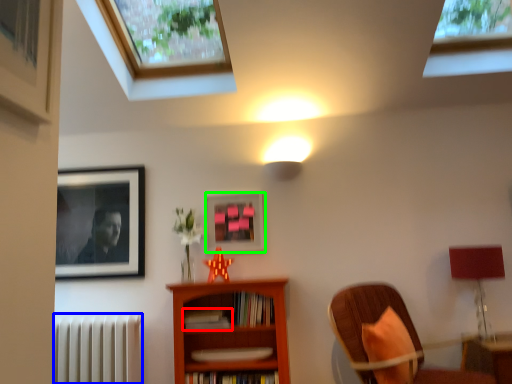
Question: Based on their relative distances, which object is nearer to book (highlighted by a red box)? Choose from radiator (highlighted by a blue box) and picture frame (highlighted by a green box).

Choices:
 (A) radiator
 (B) picture frame

Answer: (B)